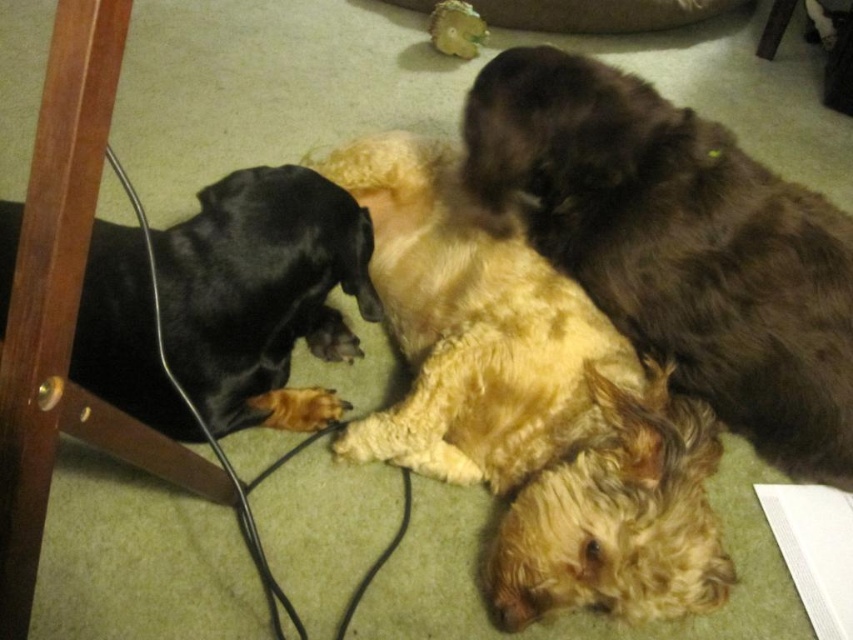
Is fluffy golden dog at center in front of fluffy brown dog at upper right?

Yes.

Who is lower down, fluffy golden dog at center or fluffy brown dog at upper right?

Positioned lower is fluffy golden dog at center.

Describe the element at coordinates (531, 404) in the screenshot. The image size is (853, 640). I see `fluffy golden dog at center` at that location.

The height and width of the screenshot is (640, 853). Identify the location of fluffy golden dog at center. (531, 404).

How distant is fluffy golden dog at center from black smooth fur dog at left?

10.65 inches

Is fluffy golden dog at center to the left of black smooth fur dog at left from the viewer's perspective?

Incorrect, fluffy golden dog at center is not on the left side of black smooth fur dog at left.

Who is more forward, [552,573] or [368,296]?

Point [552,573]

This screenshot has height=640, width=853. I want to click on fluffy golden dog at center, so click(x=531, y=404).

Which is behind, point (828, 276) or point (293, 285)?

Point (828, 276)

Who is higher up, fluffy brown dog at upper right or black smooth fur dog at left?

fluffy brown dog at upper right

Locate an element on the screen. This screenshot has height=640, width=853. fluffy brown dog at upper right is located at coordinates (679, 244).